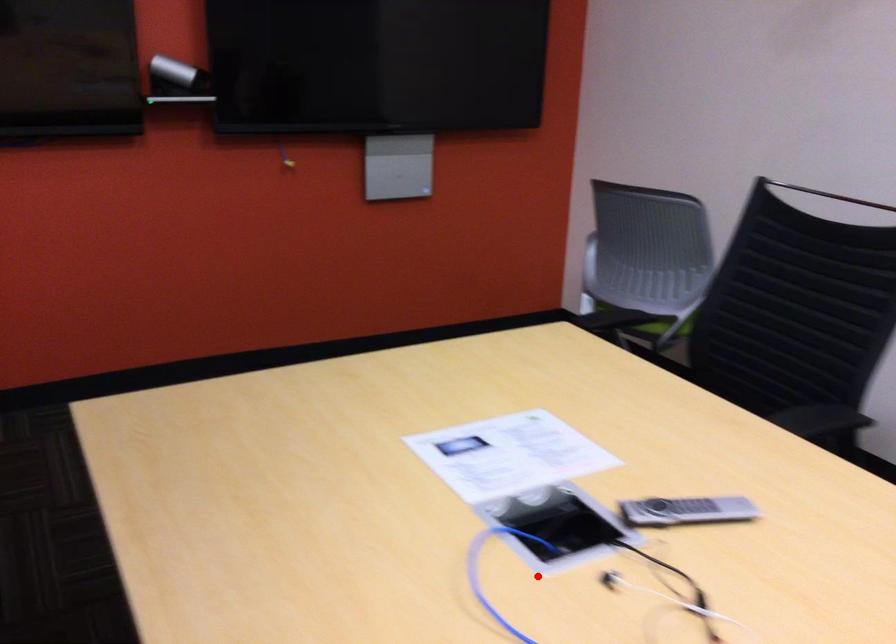
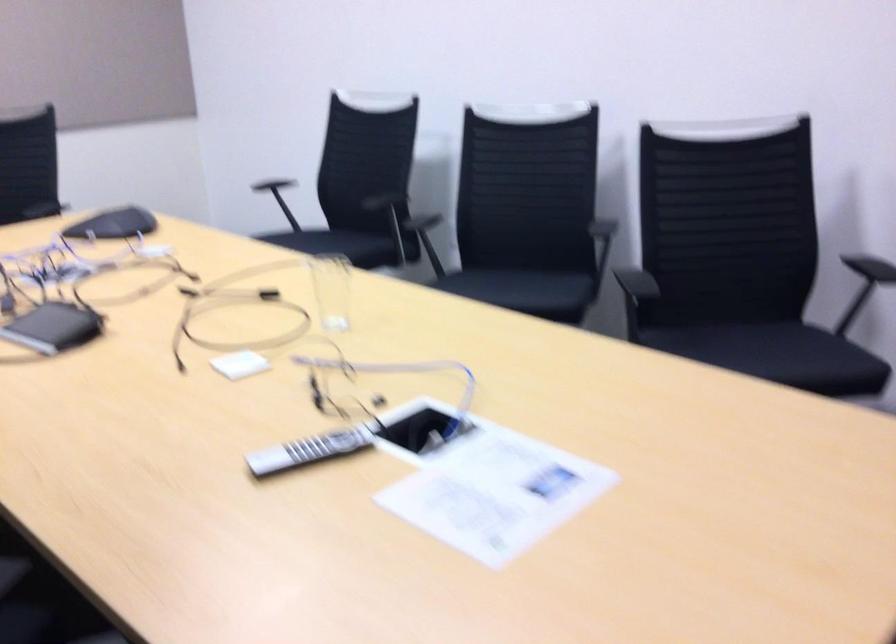
Question: I am providing you with two images of the same scene from different viewpoints. Image1 has a red point marked. In image2, the corresponding 3D location appears at what relative position? Reply with the corresponding letter.

Choices:
 (A) Closer
 (B) Farther

Answer: (B)